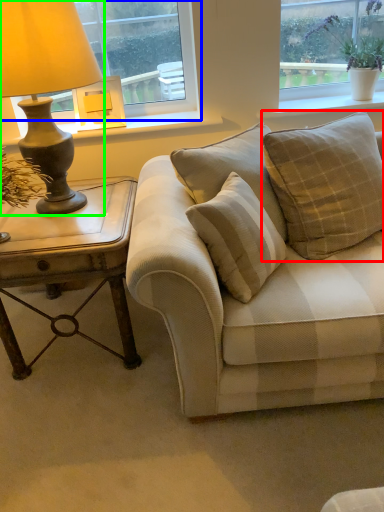
Question: Which object is the farthest from pillow (highlighted by a red box)? Choose among these: window (highlighted by a blue box) or lamp (highlighted by a green box).

Choices:
 (A) window
 (B) lamp

Answer: (B)